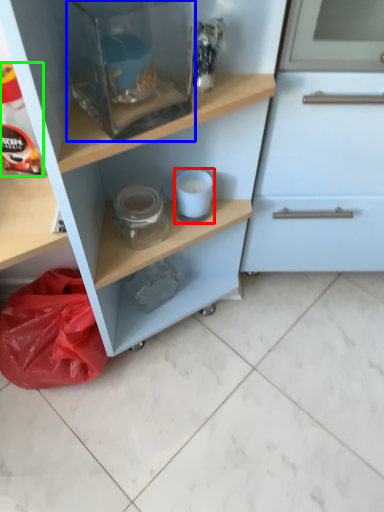
Question: Which object is positioned closest to appliance (highlighted by a red box)? Select from appliance (highlighted by a blue box) and bottle (highlighted by a green box).

Choices:
 (A) appliance
 (B) bottle

Answer: (A)